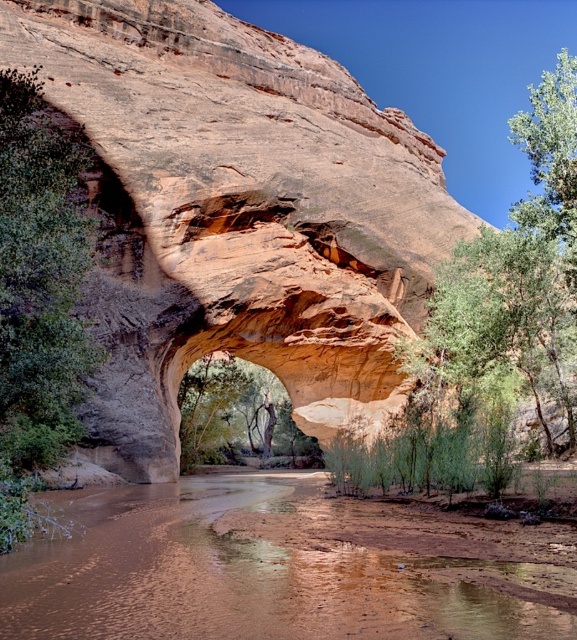
Question: Considering the relative positions of brown sedimentary river at lower center and green leafy tree at left in the image provided, where is brown sedimentary river at lower center located with respect to green leafy tree at left?

Choices:
 (A) right
 (B) left

Answer: (A)

Question: In this image, where is brown sedimentary river at lower center located relative to green leafy tree at left?

Choices:
 (A) above
 (B) below

Answer: (B)

Question: Does brown sedimentary river at lower center appear under green leafy tree at left?

Choices:
 (A) yes
 (B) no

Answer: (A)